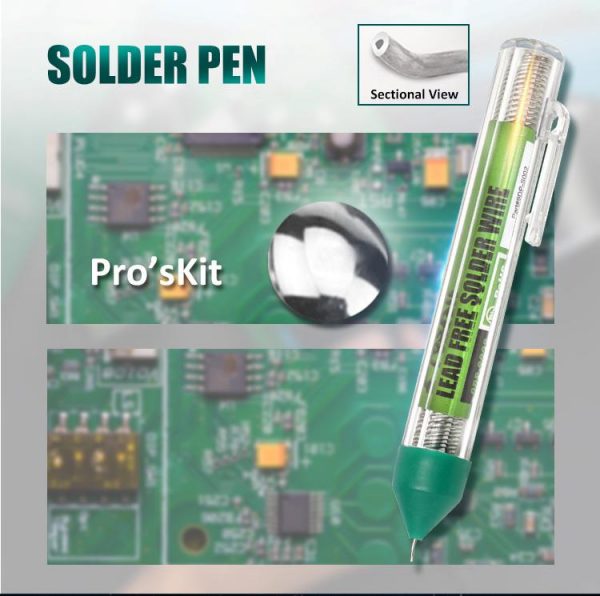
What are the coordinates of `computer piece` in the screenshot? It's located at tap(298, 514).